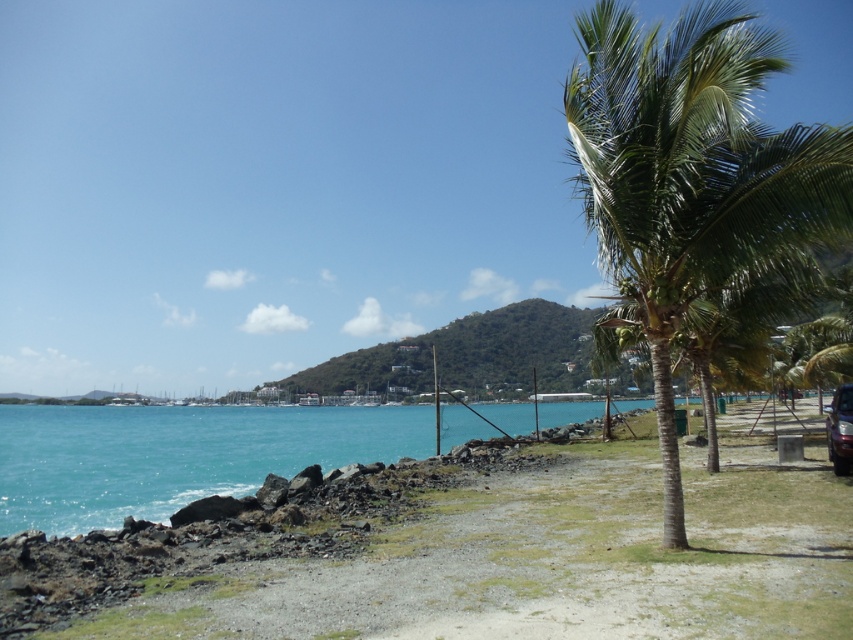
You are standing on the sandy path and see two points marked in the scene. Which point is closer to you, point (370, 490) or point (103, 499)?

Point (370, 490) is in front of point (103, 499), so it is closer to you.

You are standing on the sandy path and want to walk towards the turquoise water at lower left. Which direction should you turn to avoid the green leafy palm tree at right?

You should turn to the left to avoid the green leafy palm tree at right, as it is located to the right of the turquoise water at lower left.

You are standing at the point with coordinates point (630,257) and want to walk towards the point (384,429). According to the scene description, will you walk towards a direction that is closer to the sea or the palm trees?

Point (630,257) is in front of point (384,429), so walking from point (630,257) to point (384,429) would mean moving away from the sea and towards the palm trees.